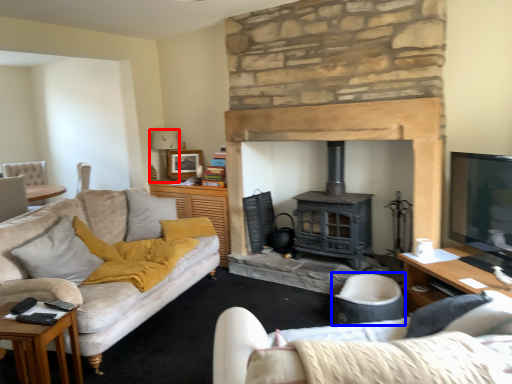
Question: Which point is closer to the camera, lamp (highlighted by a red box) or armchair (highlighted by a blue box)?

Choices:
 (A) lamp
 (B) armchair

Answer: (B)